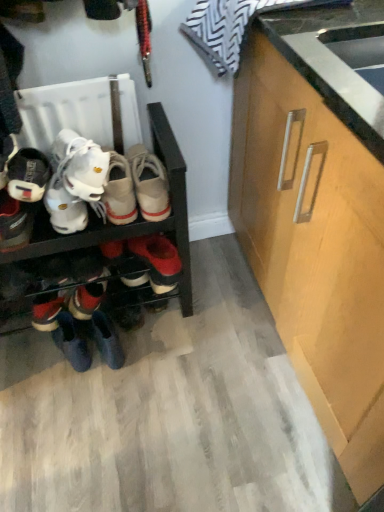
Where is `vacant space to the right of wooden shoe rack at center`? The height and width of the screenshot is (512, 384). vacant space to the right of wooden shoe rack at center is located at coordinates (216, 345).